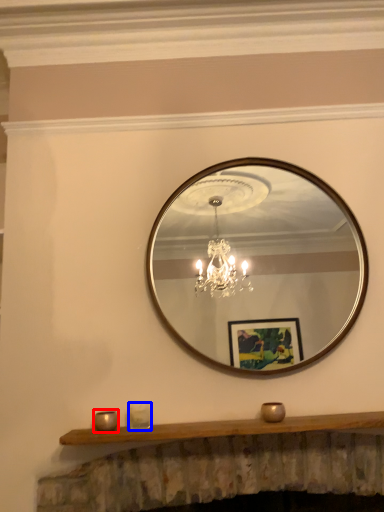
Question: Among these objects, which one is nearest to the camera, candle holder (highlighted by a red box) or candle holder (highlighted by a blue box)?

Choices:
 (A) candle holder
 (B) candle holder

Answer: (A)